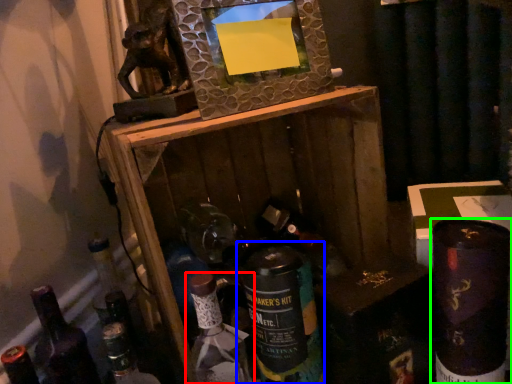
Question: Which object is positioned closest to bottle (highlighted by a red box)? Select from bottle (highlighted by a blue box) and bottle (highlighted by a green box).

Choices:
 (A) bottle
 (B) bottle

Answer: (A)